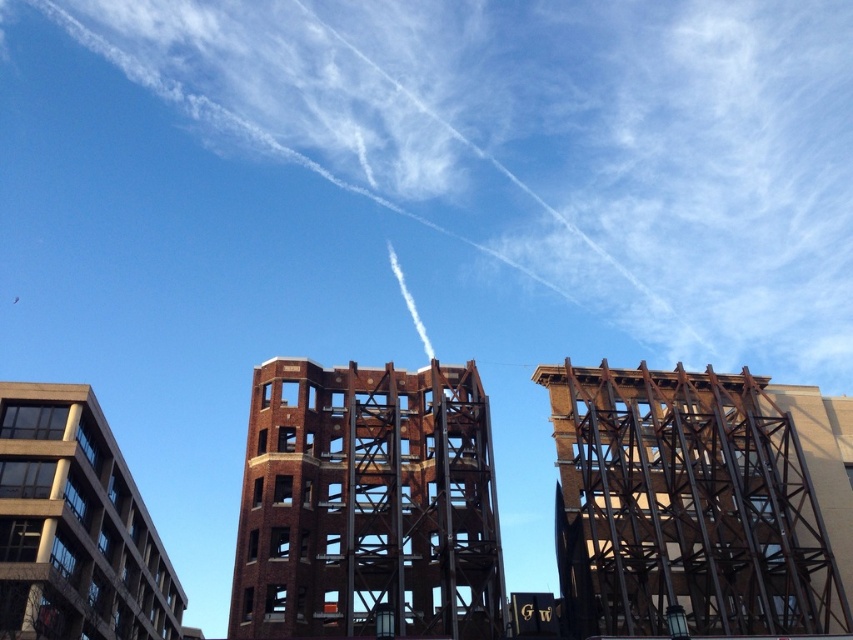
You are an inspector standing at the construction site. You need to check the rusty metal scaffolding at center and the brown brick tower at center. According to the scene, which object is positioned to the right of the other?

The rusty metal scaffolding at center is to the right of the brown brick tower at center.

You are an inspector standing at the base of the brown brick tower at center. You notice the rusty metal scaffolding at center nearby. Which object is closer to the ground?

The rusty metal scaffolding at center is positioned under the brown brick tower at center, so it is closer to the ground.